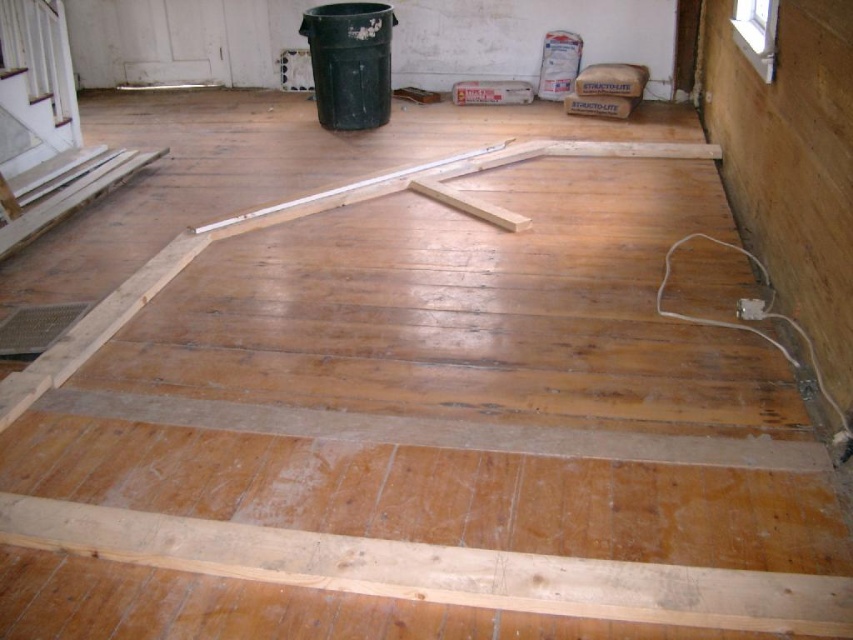
You are a construction worker standing at the entrance of the room. You need to place a new wooden beam exactly at the center of the room. However, there is already a natural wood plank at bottom located at point 0.892, 0.516. Can you still place your beam at the center without overlapping with the existing plank?

The natural wood plank at bottom is located at point [439,570]. Since the center of the room would be at point [426,320], the existing plank is positioned to the right and above the center. Therefore, you can place the new beam at the center without overlapping.

You are a contractor standing in the middle of the construction site. You need to place a new wooden beam between the two points marked as point [225,541] and point [404,170]. Which point is closer to you so you can start placing the beam from there?

Point [225,541] is closer to the viewer than point [404,170], so you should start placing the beam from point [225,541] first.